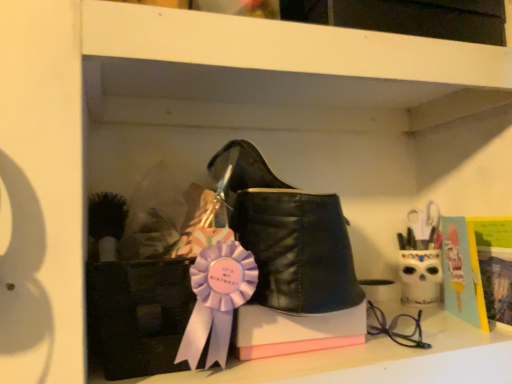
Identify the location of free point behind matte black glasses at lower right. (406, 315).